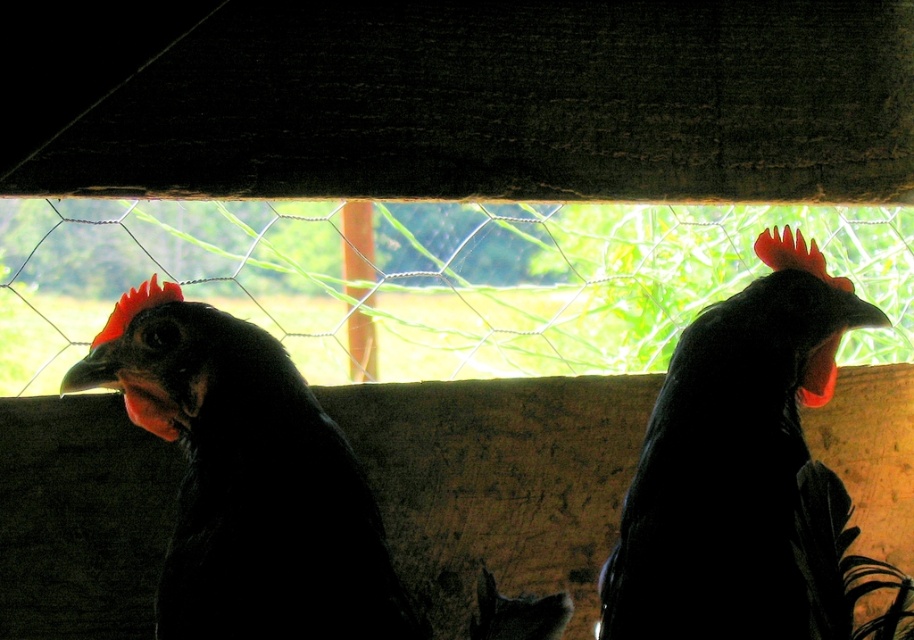
You are a farmer checking the coop. You notice a point at coordinate (247, 481). Which chicken is this point located on?

The point at coordinate (247, 481) is on the matte black chicken at left.

You are a farmer checking the coop. You notice the matte black chicken at left and the black glossy rooster at center. Which one is located below the other?

The matte black chicken at left is positioned under the black glossy rooster at center, so the chicken is below the rooster.

You are standing at the camera position and want to place a 3.5 feet long ladder so that it reaches the point at point (275, 500). Will the ladder be long enough?

The distance between the camera and point (275, 500) is 4.44 feet, which is longer than the ladder length of 3.5 feet. Therefore, the ladder will not be long enough to reach the point.